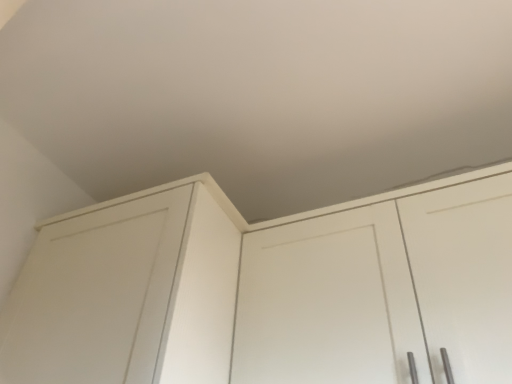
The height and width of the screenshot is (384, 512). What do you see at coordinates (269, 289) in the screenshot?
I see `white matte cupboard at center` at bounding box center [269, 289].

In order to face white matte cupboard at center, should I rotate leftwards or rightwards?

To align with it, rotate right about 17.380°.

Identify the location of white matte cupboard at center. Image resolution: width=512 pixels, height=384 pixels. (269, 289).

Image resolution: width=512 pixels, height=384 pixels. Identify the location of white matte cupboard at center. [x=269, y=289].